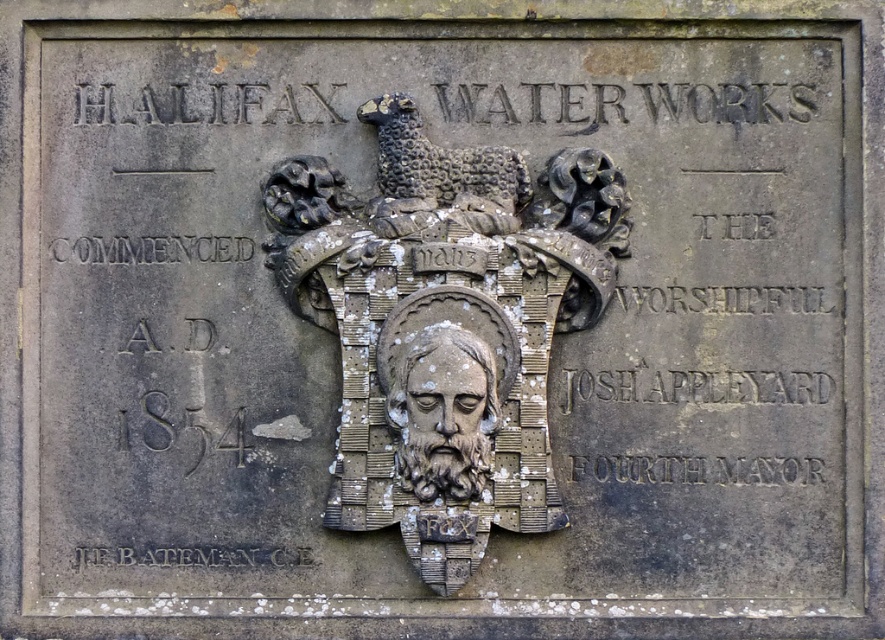
Question: Estimate the real-world distances between objects in this image. Which object is closer to the rusty metal shield at center?

Choices:
 (A) black stone text at upper left
 (B) gray stone face at center

Answer: (B)

Question: Can you confirm if black stone text at upper left is wider than black stone engraving at lower left?

Choices:
 (A) yes
 (B) no

Answer: (B)

Question: Among these points, which one is farthest from the camera?

Choices:
 (A) (179, 545)
 (B) (373, 476)
 (C) (191, 252)

Answer: (C)

Question: Which object appears closest to the camera in this image?

Choices:
 (A) gray stone face at center
 (B) black stone engraving at lower left

Answer: (A)

Question: Does black stone text at upper left have a greater width compared to black stone engraving at lower left?

Choices:
 (A) yes
 (B) no

Answer: (B)

Question: Is black stone engraving at center smaller than black stone text at upper left?

Choices:
 (A) no
 (B) yes

Answer: (A)